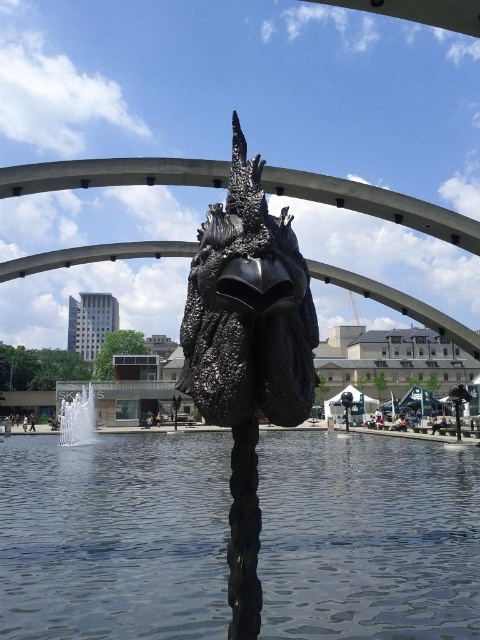
Question: Which object appears closest to the camera in this image?

Choices:
 (A) transparent glass water at center
 (B) white glossy water at center

Answer: (A)

Question: Is transparent glass water at center above white glossy water at center?

Choices:
 (A) yes
 (B) no

Answer: (A)

Question: Which object is positioned farthest from the transparent glass water at center?

Choices:
 (A) white glossy water at center
 (B) black textured sculpture at center

Answer: (A)

Question: Can you confirm if transparent glass water at center is smaller than white glossy water at center?

Choices:
 (A) no
 (B) yes

Answer: (A)

Question: Which point is closer to the camera?

Choices:
 (A) (195, 301)
 (B) (393, 579)
 (C) (83, 403)

Answer: (A)

Question: Considering the relative positions of transparent glass water at center and black textured sculpture at center in the image provided, where is transparent glass water at center located with respect to black textured sculpture at center?

Choices:
 (A) below
 (B) above

Answer: (A)